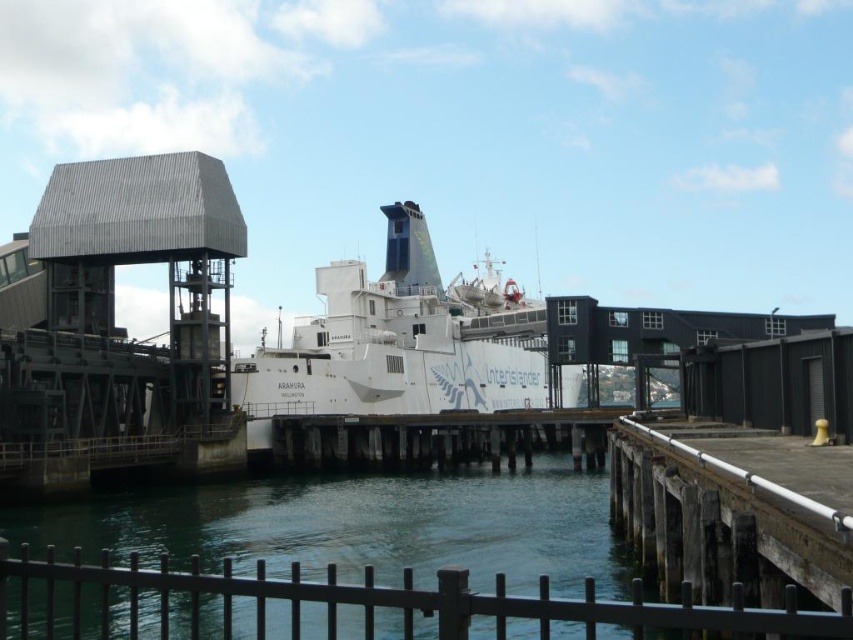
Consider the image. Who is lower down, white matte ship at center or wooden at center?

Positioned lower is wooden at center.

Can you confirm if white matte ship at center is wider than wooden at center?

Indeed, white matte ship at center has a greater width compared to wooden at center.

Who is more forward, (399, 324) or (381, 456)?

Point (381, 456) is more forward.

Locate an element on the screen. This screenshot has height=640, width=853. white matte ship at center is located at coordinates (398, 340).

Can you confirm if greenish water at lower center is positioned to the left of white matte ship at center?

Yes, greenish water at lower center is to the left of white matte ship at center.

Does greenish water at lower center appear under white matte ship at center?

Yes, greenish water at lower center is below white matte ship at center.

The height and width of the screenshot is (640, 853). What are the coordinates of `greenish water at lower center` in the screenshot? It's located at (364, 525).

Who is positioned more to the right, greenish water at lower center or wooden at center?

wooden at center

Is greenish water at lower center to the right of wooden at center from the viewer's perspective?

No, greenish water at lower center is not to the right of wooden at center.

Which is behind, point (401, 518) or point (567, 436)?

The point (567, 436) is behind.

The image size is (853, 640). In order to click on greenish water at lower center in this screenshot , I will do `click(364, 525)`.